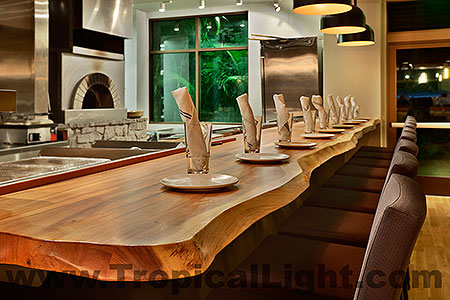
Where is `door`? door is located at coordinates (440, 91).